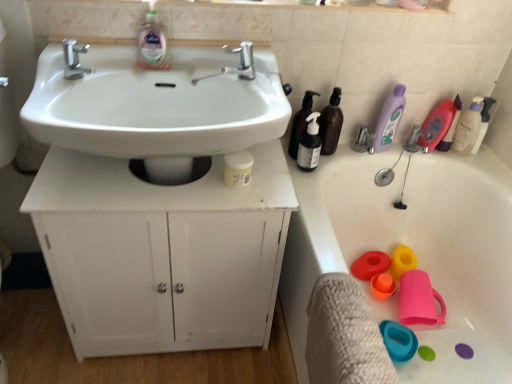
You are a GUI agent. You are given a task and a screenshot of the screen. Output one action in this format:
    pyautogui.click(x=<x>, y=<y>)
    Task: Click on the vacant area that is in front of polished chrome faucet at upper left, the 1th tap from the left
    
    Given the screenshot: What is the action you would take?
    pyautogui.click(x=55, y=91)